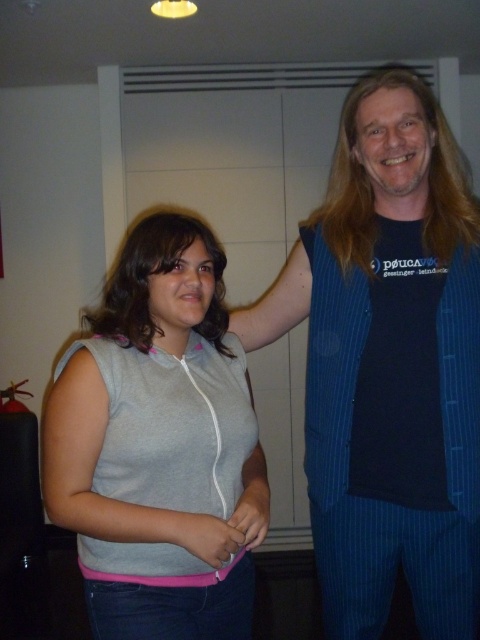
You are a photographer setting up for a portrait. You notice the gray fabric sleeveless top at center and the pink fabric hand at center in the frame. Which object is positioned to the left in the image?

The gray fabric sleeveless top at center is to the left of the pink fabric hand at center according to the description.

You are a photographer adjusting the camera focus. You need to ensure both the blue pinstripe vest at center and the pink fabric hand at center are in focus. Which object should you adjust the focus to first, considering their sizes?

The blue pinstripe vest at center has a larger size compared to the pink fabric hand at center, so you should focus on the blue pinstripe vest at center first to ensure its details are sharp before adjusting for the smaller pink fabric hand at center.

You are a photographer setting up for a group photo. You notice the blue pinstripe vest at center and the gray fabric sleeveless top at center. Which clothing item should you adjust your camera focus on if you want to capture the person on the right more clearly?

The blue pinstripe vest at center is to the right of the gray fabric sleeveless top at center, so you should focus on the blue pinstripe vest at center to capture the person on the right more clearly.